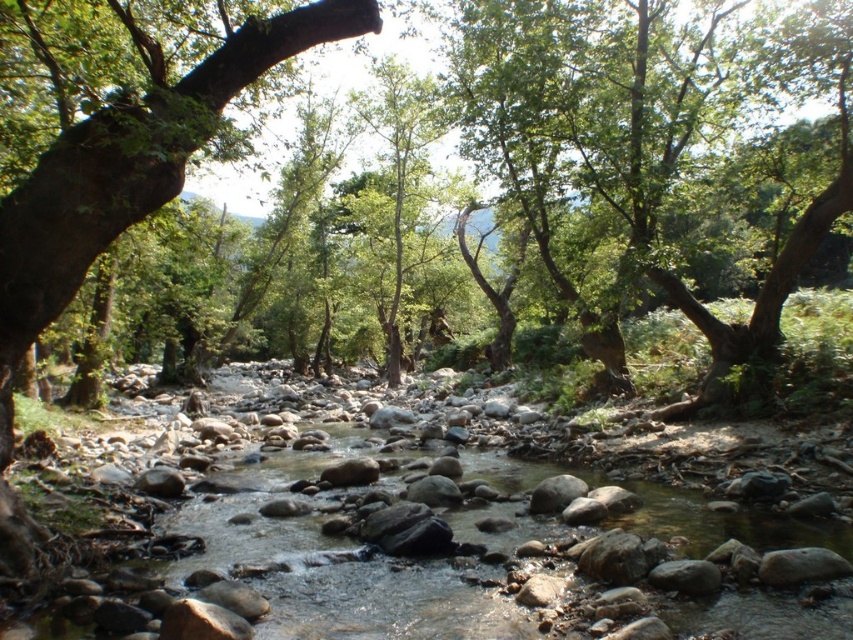
You are planning to plant a new tree that requires at least 50 feet of space between it and other trees. Based on the image, can you plant it between the green leafy tree at upper center and the green rough bark tree at left?

The distance between the green leafy tree at upper center and the green rough bark tree at left is 48.33 feet, which is less than the required 50 feet. Therefore, you cannot plant the new tree between them as there isn not enough space.

You are standing in the forest near the stream and want to take a photo of the green leafy tree at upper center. If your camera has a maximum focus range of 10 meters, will you be able to capture a clear image of the tree?

The green leafy tree at upper center is 12.10 meters away from the viewer. Since the camera can only focus up to 10 meters, you won generated by the model. Please follow the rules to create a new question and answer pair based on the provided information. 12.10 meters away, so the camera cannot focus on it clearly. Move closer to within 10 meters for a sharp photo.

You are a hiker trying to determine which tree to climb for a better view. The green leafy tree at upper center and the green rough bark tree at left are both in your path. Which tree would you choose to climb for a higher vantage point?

The green leafy tree at upper center is much taller than the green rough bark tree at left, so climbing it would provide a higher vantage point.